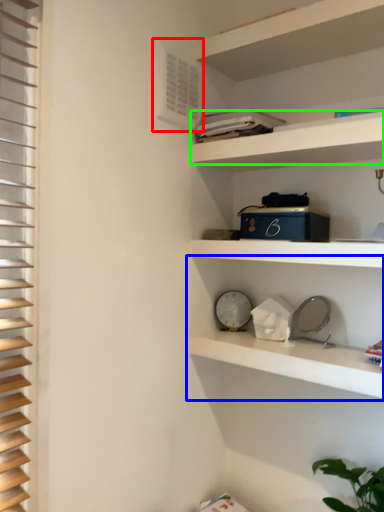
Question: Based on their relative distances, which object is nearer to air conditioning (highlighted by a red box)? Choose from shelf (highlighted by a blue box) and cabinet (highlighted by a green box).

Choices:
 (A) shelf
 (B) cabinet

Answer: (B)